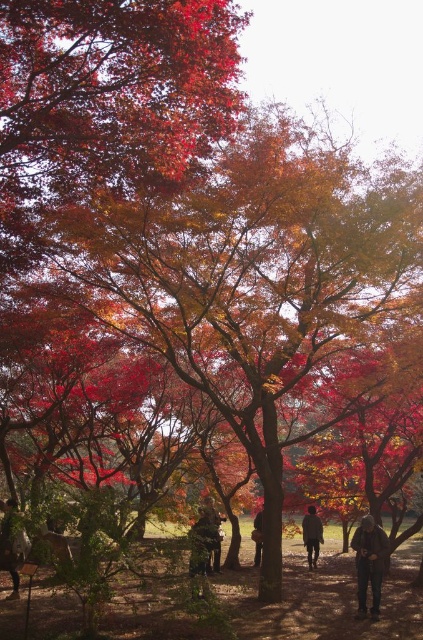
Question: Observing the image, what is the correct spatial positioning of dark brown leather jacket at center in reference to dark gray jacket at center?

Choices:
 (A) right
 (B) left

Answer: (A)

Question: Is dark brown leather jacket at lower right thinner than dark gray jacket at center?

Choices:
 (A) yes
 (B) no

Answer: (A)

Question: Considering the real-world distances, which object is farthest from the dark gray jacket at center?

Choices:
 (A) dark green textured jacket at center
 (B) dark brown leather jacket at center

Answer: (A)

Question: Is dark green textured jacket at center thinner than dark gray jacket at center?

Choices:
 (A) yes
 (B) no

Answer: (A)

Question: Which object appears farthest from the camera in this image?

Choices:
 (A) dark green textured jacket at center
 (B) dark brown leather jacket at center
 (C) dark brown leather jacket at lower right
 (D) dark gray sweater at center

Answer: (B)

Question: Which object is positioned closest to the dark brown leather jacket at center?

Choices:
 (A) dark brown leather jacket at lower right
 (B) dark brown leather jacket at lower left
 (C) dark gray sweater at center

Answer: (C)